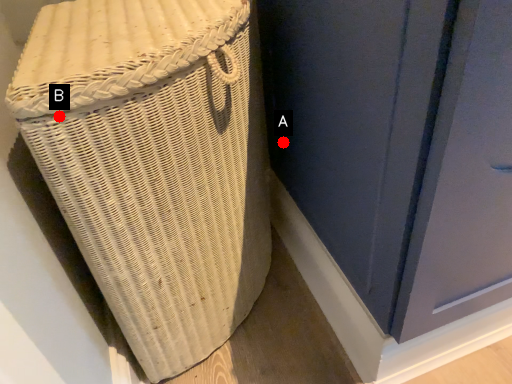
Question: Two points are circled on the image, labeled by A and B beside each circle. Among these points, which one is farthest from the camera?

Choices:
 (A) A is further
 (B) B is further

Answer: (A)